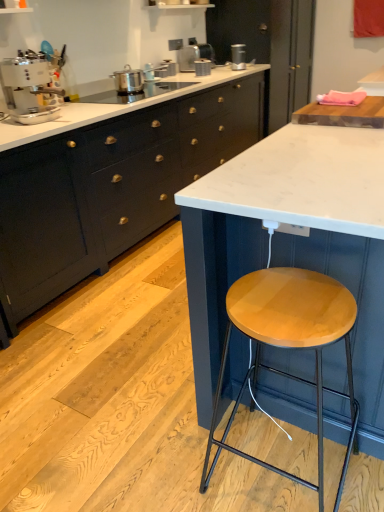
Question: Is satin silver toaster at upper center, which is counted as the fourth appliance, starting from the right, bigger or smaller than satin silver toaster at upper center, which appears as the 2th appliance when viewed from the back?

Choices:
 (A) small
 (B) big

Answer: (A)

Question: From a real-world perspective, is satin silver toaster at upper center, which is counted as the fourth appliance, starting from the right, physically located above or below satin silver toaster at upper center, which appears as the 2th appliance when viewed from the back?

Choices:
 (A) below
 (B) above

Answer: (A)

Question: Estimate the real-world distances between objects in this image. Which object is closer to the white marble countertop at center, which ranks as the 2th countertop in top-to-bottom order?

Choices:
 (A) matte black cabinets at center, the first cabinetry viewed from the left
 (B) satin silver toaster at upper center, acting as the 3th appliance starting from the back
 (C) wooden cutting board at upper right, which is the 1th countertop in top-to-bottom order
 (D) white glossy coffee machine at upper left, which appears as the 5th appliance when viewed from the top
 (E) satin silver toaster at upper center, which ranks as the fifth appliance in front-to-back order

Answer: (C)

Question: Considering the real-world distances, which object is closest to the matte black cabinets at center, the first cabinetry viewed from the left?

Choices:
 (A) white marble countertop at center, which ranks as the 2th countertop in top-to-bottom order
 (B) wooden seat stool at center
 (C) matte black cabinet at center, the second cabinetry positioned from the left
 (D) wooden cutting board at upper right, which is the 1th countertop in top-to-bottom order
 (E) satin silver toaster at upper center, the third appliance when ordered from left to right

Answer: (C)